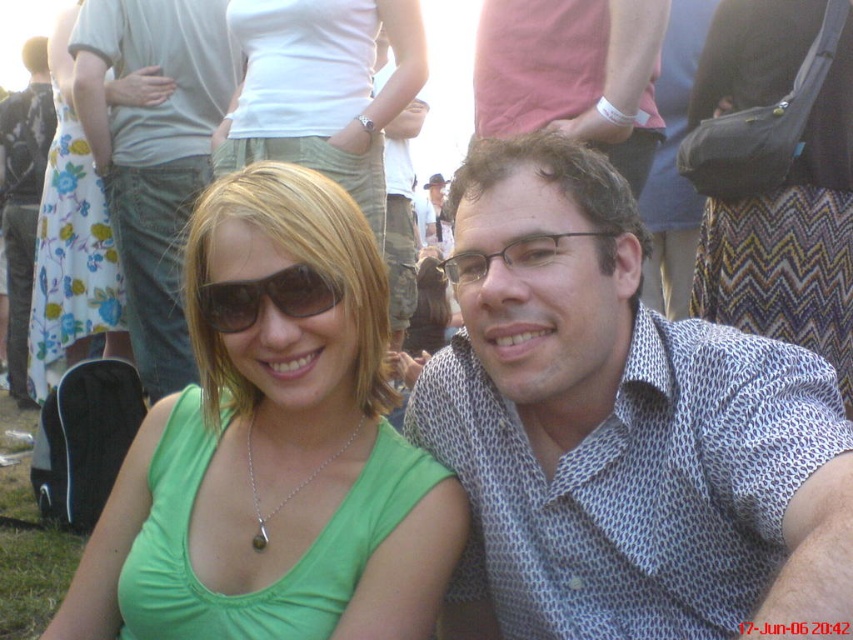
Question: Which point is closer to the camera taking this photo?

Choices:
 (A) (318, 45)
 (B) (195, 486)

Answer: (B)

Question: Does green fabric top at center appear over matte pink shirt at upper center?

Choices:
 (A) yes
 (B) no

Answer: (B)

Question: Can you confirm if white dotted shirt at center is wider than green fabric top at center?

Choices:
 (A) yes
 (B) no

Answer: (B)

Question: Considering the real-world distances, which object is farthest from the matte pink shirt at upper center?

Choices:
 (A) matte black sunglasses at center
 (B) white dotted shirt at center

Answer: (A)

Question: Is matte pink shirt at upper center wider than floral cotton skirt at left?

Choices:
 (A) no
 (B) yes

Answer: (B)

Question: Which of the following is the farthest from the observer?

Choices:
 (A) (428, 218)
 (B) (119, 273)
 (C) (512, 113)

Answer: (A)